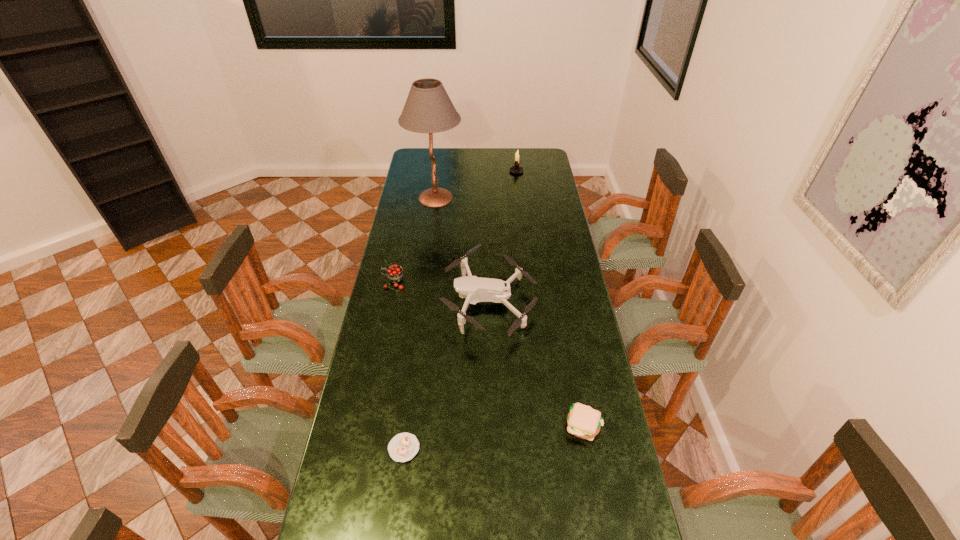
Find the location of `patty located in the right edge section of the desktop`. patty located in the right edge section of the desktop is located at coordinates (583, 421).

Find the location of a particular element. The height and width of the screenshot is (540, 960). object that is at the far right corner is located at coordinates (516, 169).

In the image, there is a desktop. Identify the location of vacant space at the far edge. [x=461, y=155].

I want to click on vacant space at the left edge of the desktop, so click(428, 219).

This screenshot has width=960, height=540. I want to click on vacant space at the right edge of the desktop, so click(564, 219).

Find the location of a particular element. The width and height of the screenshot is (960, 540). free space at the far left corner is located at coordinates (428, 158).

Find the location of a particular element. blank space at the far right corner of the desktop is located at coordinates (535, 158).

This screenshot has width=960, height=540. Identify the location of free space that is in between the drone and the cupcake. (446, 375).

Locate an element on the screen. Image resolution: width=960 pixels, height=540 pixels. vacant space in between the fifth nearest object and the cherry is located at coordinates 415,240.

Find the location of a particular element. This screenshot has width=960, height=540. free space between the patty and the shortest object is located at coordinates (493, 437).